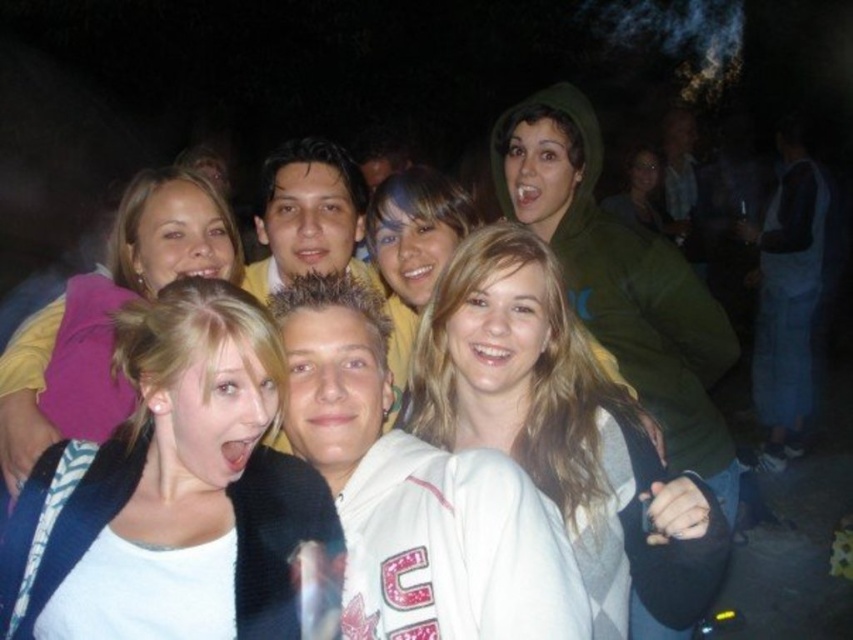
Who is lower down, white matte jacket at center or white fleece jacket at center?

white fleece jacket at center is below.

Can you confirm if white matte jacket at center is taller than white fleece jacket at center?

No, white matte jacket at center is not taller than white fleece jacket at center.

Does point (247, 461) lie behind point (479, 500)?

That is True.

What are the coordinates of `white matte jacket at center` in the screenshot? It's located at (186, 474).

Which is below, white sweater at center or smooth green hoodie at upper center?

white sweater at center

Measure the distance between white sweater at center and camera.

4.21 feet

The image size is (853, 640). Identify the location of white sweater at center. (558, 426).

Can you confirm if white matte jacket at center is positioned to the left of matte green hoodie at upper center?

Answer: Correct, you'll find white matte jacket at center to the left of matte green hoodie at upper center.

Based on the photo, who is positioned more to the left, white matte jacket at center or matte green hoodie at upper center?

From the viewer's perspective, white matte jacket at center appears more on the left side.

Is point (300, 465) in front of point (606, 198)?

Yes, point (300, 465) is in front of point (606, 198).

Identify the location of white matte jacket at center. (186, 474).